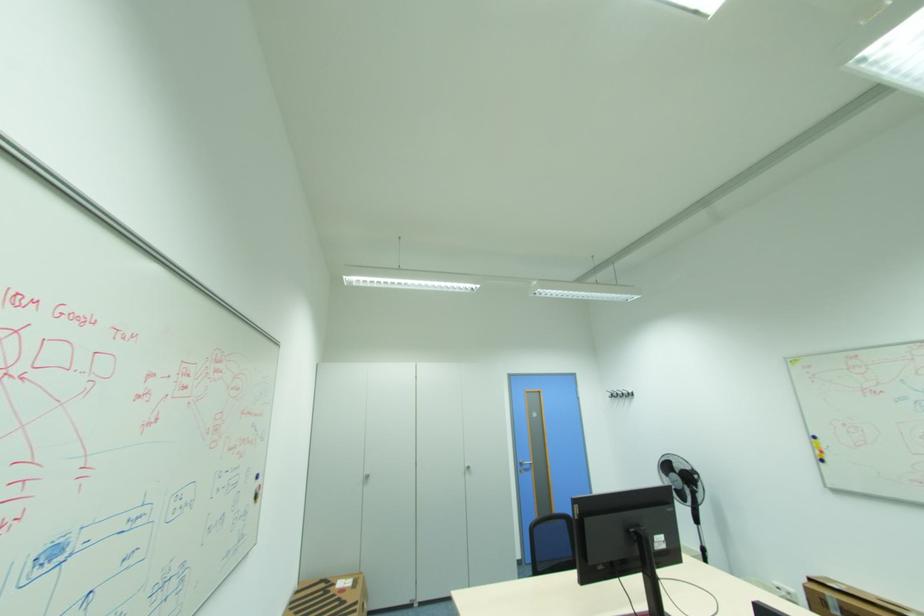
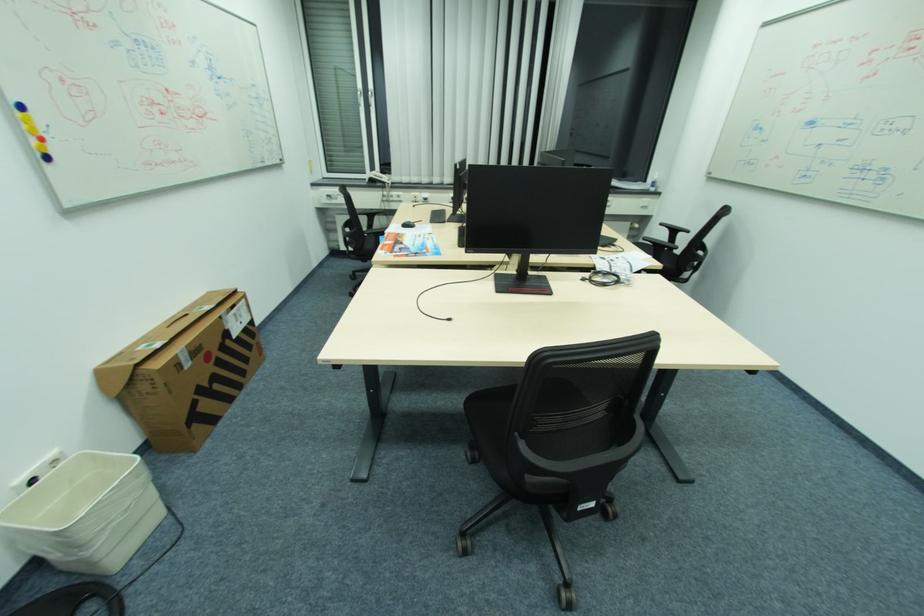
Find the pixel in the second image that matches (x=819, y=440) in the first image.

(21, 114)